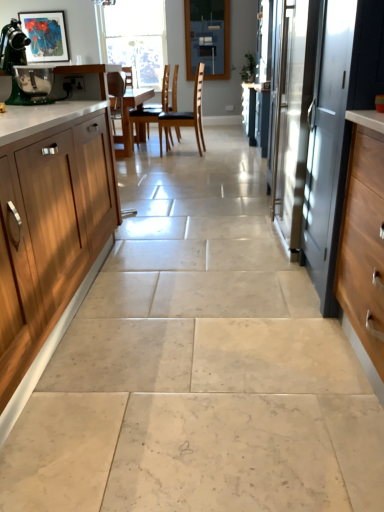
In order to click on free location to the right of wooden cabinet at left in this screenshot , I will do `click(201, 297)`.